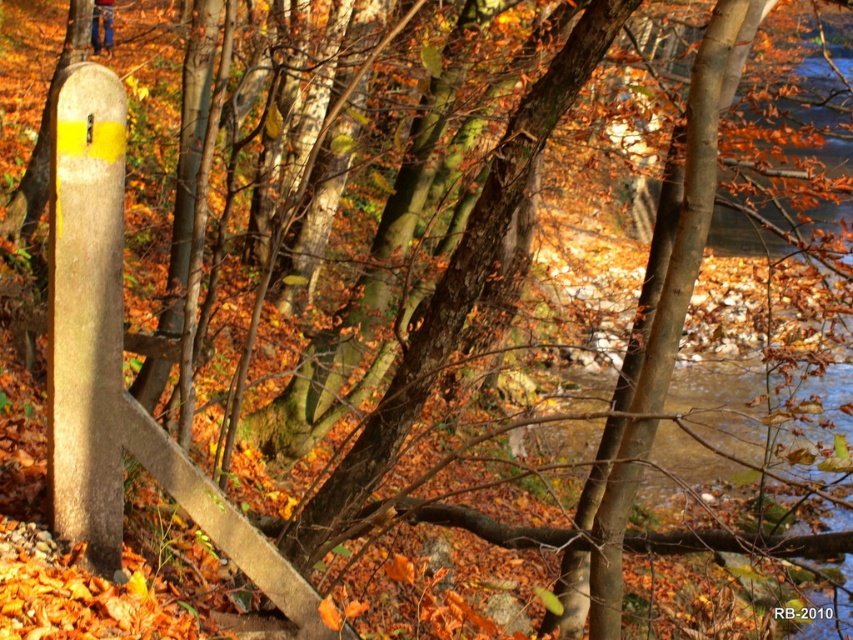
You are a photographer setting up a tripod in this autumn scene. You need to ensure that the smooth concrete post at left and the blue denim jeans at upper left are both visible in your shot. Given their heights, which object will appear taller in the photograph?

The smooth concrete post at left will appear taller in the photograph because it has a greater height compared to the blue denim jeans at upper left.

In the scene shown: You are an artist setting up an easel to paint the autumn scene. You notice the smooth concrete post at left and the blue denim jeans at upper left in your view. Which object takes up more visual space in your painting?

The blue denim jeans at upper left takes up more visual space than the smooth concrete post at left because the smooth concrete post at left occupies less space than blue denim jeans at upper left.